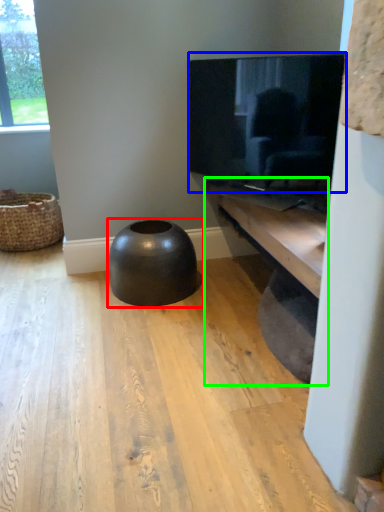
Question: Based on their relative distances, which object is farther from stool (highlighted by a red box)? Choose from television (highlighted by a blue box) and shelf (highlighted by a green box).

Choices:
 (A) television
 (B) shelf

Answer: (A)